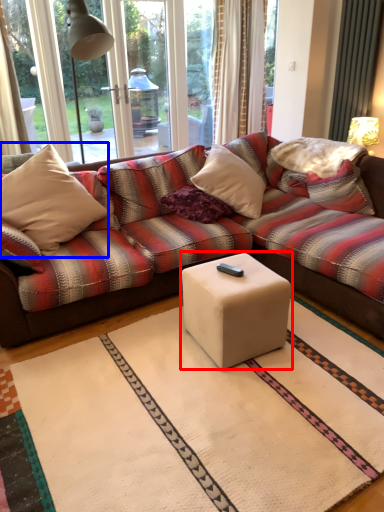
Question: Which object appears closest to the camera in this image, coffee table (highlighted by a red box) or throw pillow (highlighted by a blue box)?

Choices:
 (A) coffee table
 (B) throw pillow

Answer: (A)